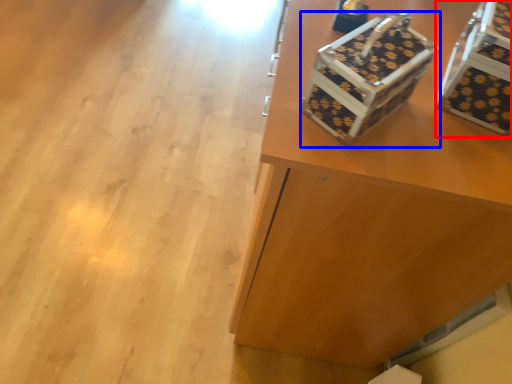
Question: Which object appears farthest to the camera in this image, storage box (highlighted by a red box) or shoe box (highlighted by a blue box)?

Choices:
 (A) storage box
 (B) shoe box

Answer: (A)